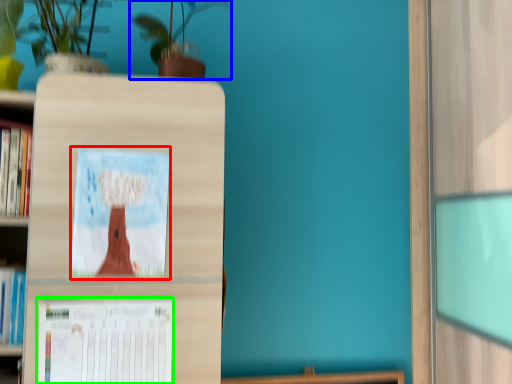
Question: Estimate the real-world distances between objects in this image. Which object is closer to picture frame (highlighted by a red box), houseplant (highlighted by a blue box) or paperback book (highlighted by a green box)?

Choices:
 (A) houseplant
 (B) paperback book

Answer: (B)